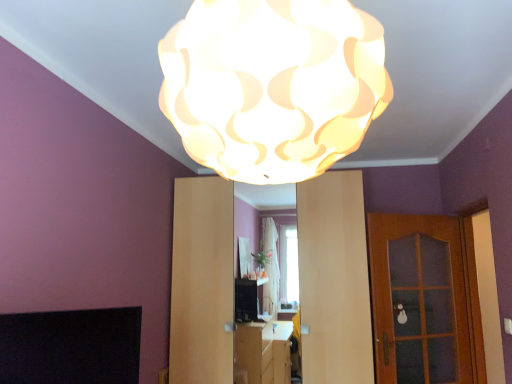
Question: Would you say wooden glass door at right contains white matte lampshade at upper center?

Choices:
 (A) no
 (B) yes

Answer: (A)

Question: Is wooden glass door at right smaller than white matte lampshade at upper center?

Choices:
 (A) yes
 (B) no

Answer: (A)

Question: Can you confirm if wooden glass door at right is taller than white matte lampshade at upper center?

Choices:
 (A) no
 (B) yes

Answer: (B)

Question: From the image's perspective, is wooden glass door at right located beneath white matte lampshade at upper center?

Choices:
 (A) yes
 (B) no

Answer: (A)

Question: Does wooden glass door at right have a lesser height compared to white matte lampshade at upper center?

Choices:
 (A) yes
 (B) no

Answer: (B)

Question: Considering the positions of point (181, 259) and point (86, 317), is point (181, 259) closer or farther from the camera than point (86, 317)?

Choices:
 (A) closer
 (B) farther

Answer: (B)

Question: Is matte wood dresser at center bigger or smaller than black matte fireplace at lower left?

Choices:
 (A) big
 (B) small

Answer: (A)

Question: Is matte wood dresser at center wider or thinner than black matte fireplace at lower left?

Choices:
 (A) wide
 (B) thin

Answer: (A)

Question: From the image's perspective, is matte wood dresser at center positioned above or below black matte fireplace at lower left?

Choices:
 (A) below
 (B) above

Answer: (A)

Question: From the image's perspective, relative to matte wood dresser at center, is white matte lampshade at upper center above or below?

Choices:
 (A) below
 (B) above

Answer: (B)

Question: In terms of height, does white matte lampshade at upper center look taller or shorter compared to matte wood dresser at center?

Choices:
 (A) tall
 (B) short

Answer: (B)

Question: Based on their sizes in the image, would you say white matte lampshade at upper center is bigger or smaller than matte wood dresser at center?

Choices:
 (A) big
 (B) small

Answer: (B)

Question: Would you say white matte lampshade at upper center is inside or outside matte wood dresser at center?

Choices:
 (A) inside
 (B) outside

Answer: (B)

Question: From the image's perspective, is matte wood dresser at center located above or below wooden glass door at right?

Choices:
 (A) below
 (B) above

Answer: (B)

Question: Is matte wood dresser at center inside or outside of wooden glass door at right?

Choices:
 (A) outside
 (B) inside

Answer: (A)